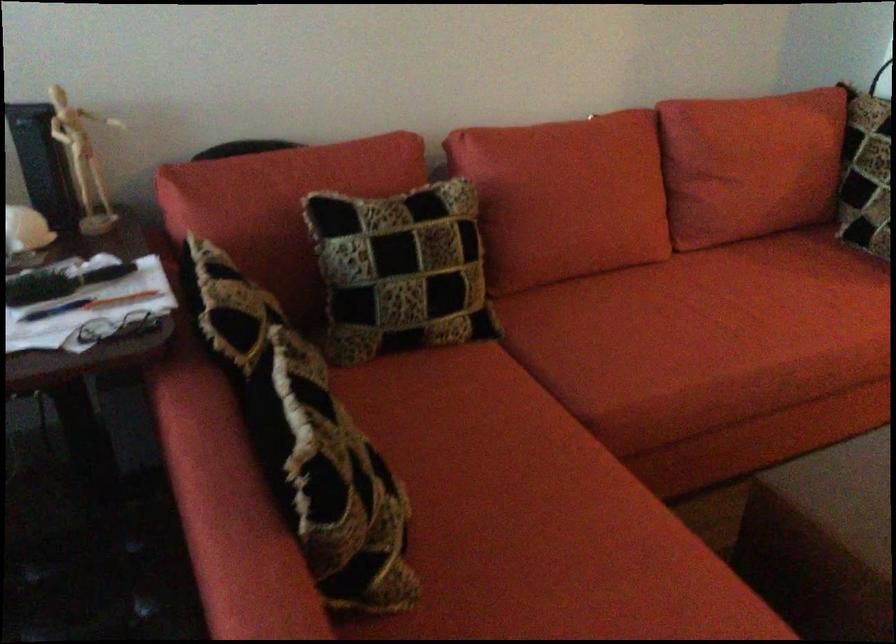
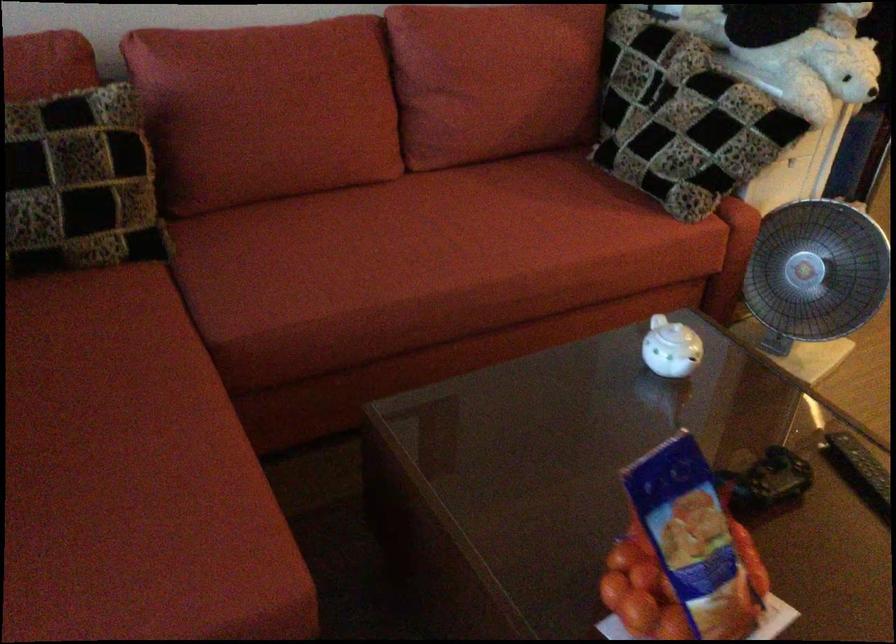
Question: Which direction would the cameraman need to move to produce the second image? Reply with the corresponding letter.

Choices:
 (A) Left
 (B) Right
 (C) Forward
 (D) Backward

Answer: (B)